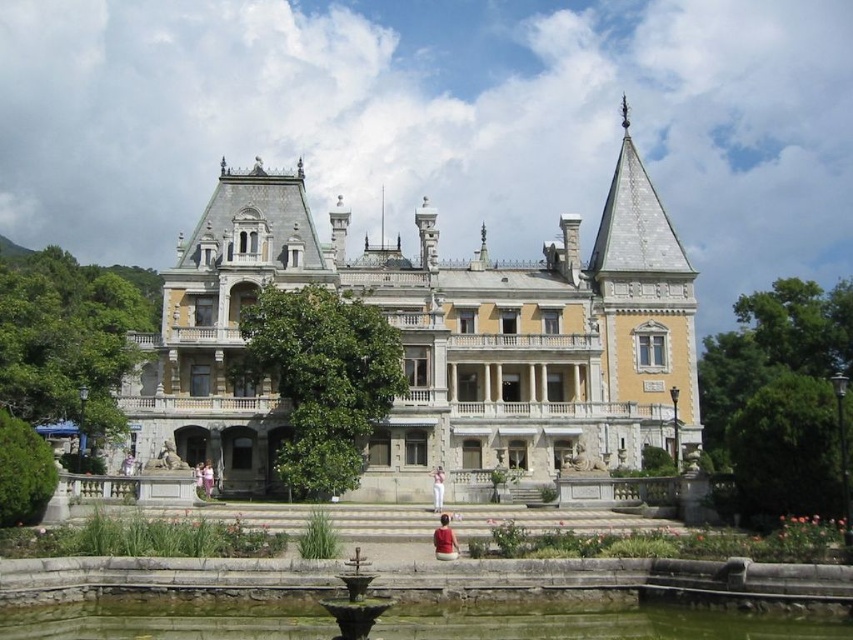
Does yellow stone palace at center have a larger size compared to bronze/rough fountain at center?

Indeed, yellow stone palace at center has a larger size compared to bronze/rough fountain at center.

Where is `yellow stone palace at center`? yellow stone palace at center is located at coordinates (433, 340).

Does bronze/rough fountain at center appear on the right side of pink fabric dress at center?

Indeed, bronze/rough fountain at center is positioned on the right side of pink fabric dress at center.

Between bronze/rough fountain at center and pink fabric dress at center, which one appears on the right side from the viewer's perspective?

From the viewer's perspective, bronze/rough fountain at center appears more on the right side.

At what (x,y) coordinates should I click in order to perform the action: click on bronze/rough fountain at center. Please return your answer as a coordinate pair (x, y). The width and height of the screenshot is (853, 640). Looking at the image, I should click on (355, 602).

Can you confirm if yellow stone palace at center is smaller than white cotton dress at center?

Actually, yellow stone palace at center might be larger than white cotton dress at center.

Does point (154, 426) come farther from viewer compared to point (440, 470)?

Yes, it is.

Identify the location of yellow stone palace at center. (433, 340).